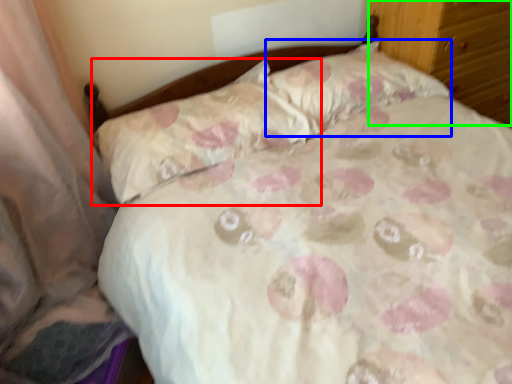
Question: Estimate the real-world distances between objects in this image. Which object is closer to pillow (highlighted by a red box), pillow (highlighted by a blue box) or dresser (highlighted by a green box)?

Choices:
 (A) pillow
 (B) dresser

Answer: (A)